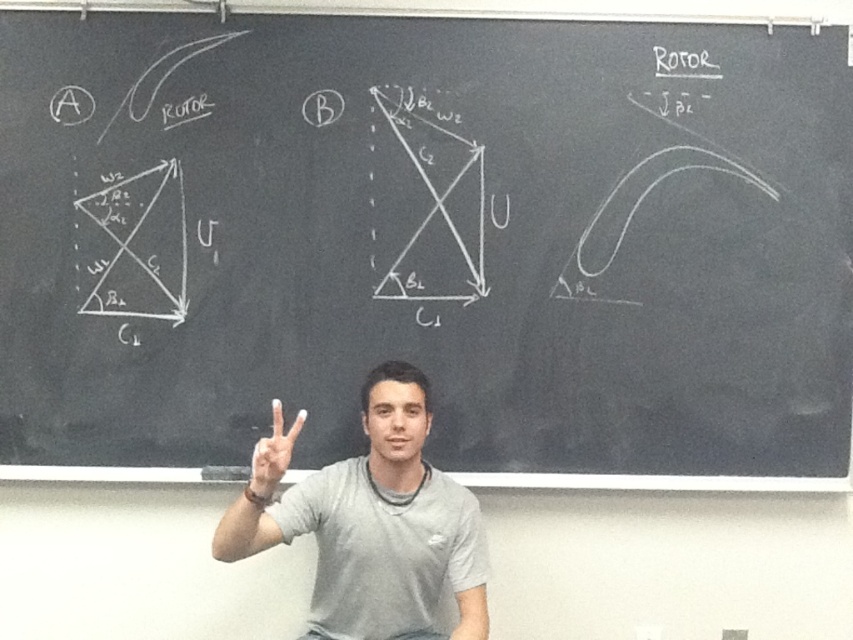
Question: Which point is farther to the camera?

Choices:
 (A) gray cotton shirt at center
 (B) white matte hand at center

Answer: (A)

Question: Is gray cotton shirt at center thinner than white matte hand at center?

Choices:
 (A) no
 (B) yes

Answer: (A)

Question: Can you confirm if gray cotton shirt at center is wider than white matte hand at center?

Choices:
 (A) no
 (B) yes

Answer: (B)

Question: Is gray cotton shirt at center smaller than white matte hand at center?

Choices:
 (A) no
 (B) yes

Answer: (A)